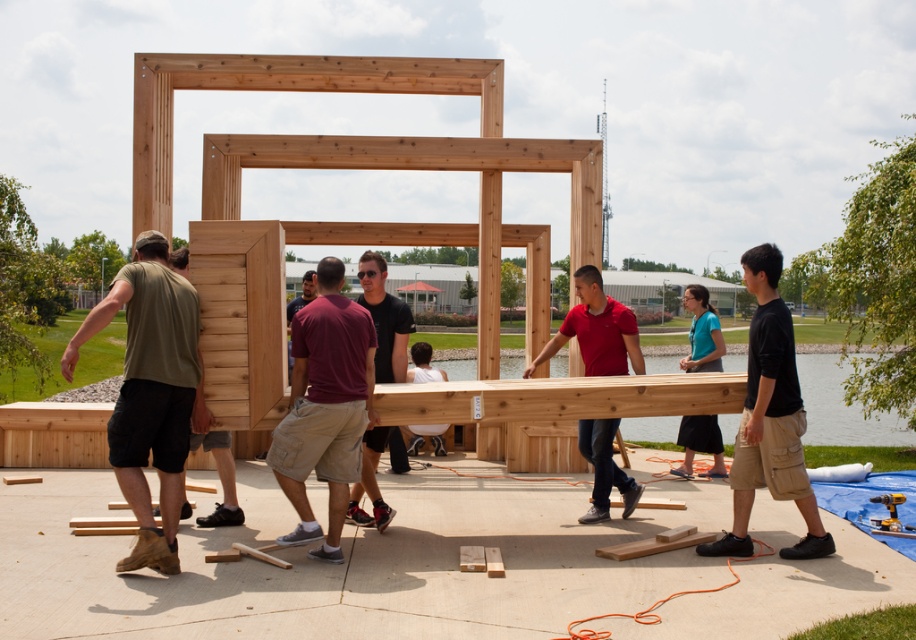
Who is positioned more to the left, matte green t-shirt at left or teal fabric shirt at center?

From the viewer's perspective, matte green t-shirt at left appears more on the left side.

Can you confirm if matte green t-shirt at left is shorter than teal fabric shirt at center?

Incorrect, matte green t-shirt at left's height does not fall short of teal fabric shirt at center's.

Which is in front, point (125, 468) or point (705, 432)?

Positioned in front is point (125, 468).

What are the coordinates of `matte green t-shirt at left` in the screenshot? It's located at (149, 392).

Does point (181, 448) lie in front of point (767, 276)?

Yes, it is.

Does point (147, 493) come in front of point (816, 545)?

Yes, point (147, 493) is closer to viewer.

The height and width of the screenshot is (640, 916). Find the location of `matte green t-shirt at left`. matte green t-shirt at left is located at coordinates (149, 392).

Between matte green t-shirt at left and matte black shirt at center, which one appears on the right side from the viewer's perspective?

matte black shirt at center is more to the right.

Which is in front, point (132, 465) or point (406, 310)?

Point (132, 465)

Which is in front, point (171, 476) or point (401, 308)?

Positioned in front is point (171, 476).

Find the location of a particular element. This screenshot has height=640, width=916. matte green t-shirt at left is located at coordinates (149, 392).